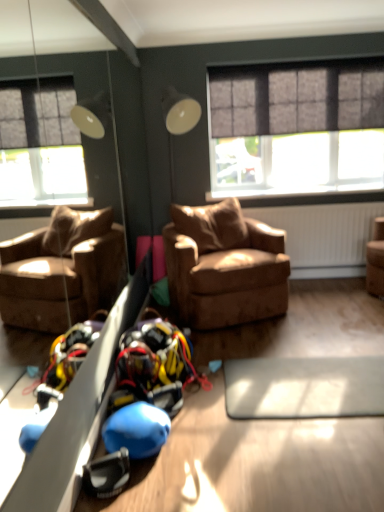
Question: From a real-world perspective, is brown leather armchair at center positioned under dark gray textured curtain at upper center based on gravity?

Choices:
 (A) no
 (B) yes

Answer: (B)

Question: Is brown leather armchair at center shorter than dark gray textured curtain at upper center?

Choices:
 (A) no
 (B) yes

Answer: (A)

Question: Considering the relative positions of brown leather armchair at center and dark gray textured curtain at upper center in the image provided, is brown leather armchair at center to the right of dark gray textured curtain at upper center from the viewer's perspective?

Choices:
 (A) no
 (B) yes

Answer: (A)

Question: Can you confirm if brown leather armchair at center is smaller than dark gray textured curtain at upper center?

Choices:
 (A) no
 (B) yes

Answer: (A)

Question: Is dark gray textured curtain at upper center at the back of brown leather armchair at center?

Choices:
 (A) yes
 (B) no

Answer: (B)

Question: From a real-world perspective, is matte gray window at upper right physically located above or below brown leather armchair at center?

Choices:
 (A) below
 (B) above

Answer: (B)

Question: In the image, is matte gray window at upper right positioned in front of or behind brown leather armchair at center?

Choices:
 (A) front
 (B) behind

Answer: (B)

Question: Which is correct: matte gray window at upper right is inside brown leather armchair at center, or outside of it?

Choices:
 (A) outside
 (B) inside

Answer: (A)

Question: In terms of size, does matte gray window at upper right appear bigger or smaller than brown leather armchair at center?

Choices:
 (A) big
 (B) small

Answer: (B)

Question: Do you think brown leather armchair at center is within dark gray textured curtain at upper center, or outside of it?

Choices:
 (A) inside
 (B) outside

Answer: (B)

Question: Based on their sizes in the image, would you say brown leather armchair at center is bigger or smaller than dark gray textured curtain at upper center?

Choices:
 (A) small
 (B) big

Answer: (B)

Question: Does point (185, 241) appear closer or farther from the camera than point (283, 96)?

Choices:
 (A) farther
 (B) closer

Answer: (B)

Question: Relative to dark gray textured curtain at upper center, is brown leather armchair at center in front or behind?

Choices:
 (A) front
 (B) behind

Answer: (A)

Question: Considering their positions, is dark gray textured curtain at upper center located in front of or behind matte gray window at upper right?

Choices:
 (A) behind
 (B) front

Answer: (B)

Question: Looking at their shapes, would you say dark gray textured curtain at upper center is wider or thinner than matte gray window at upper right?

Choices:
 (A) thin
 (B) wide

Answer: (B)